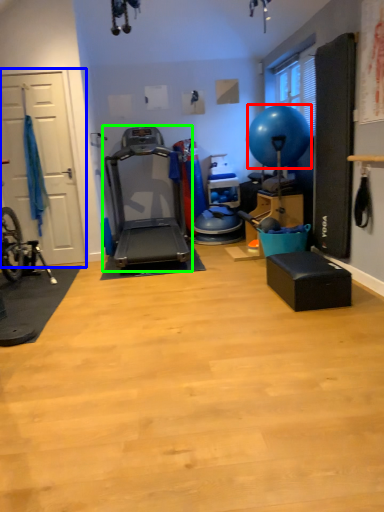
Question: Which object is positioned closest to balloon (highlighted by a red box)? Select from garage door (highlighted by a blue box) and treadmill (highlighted by a green box).

Choices:
 (A) garage door
 (B) treadmill

Answer: (B)